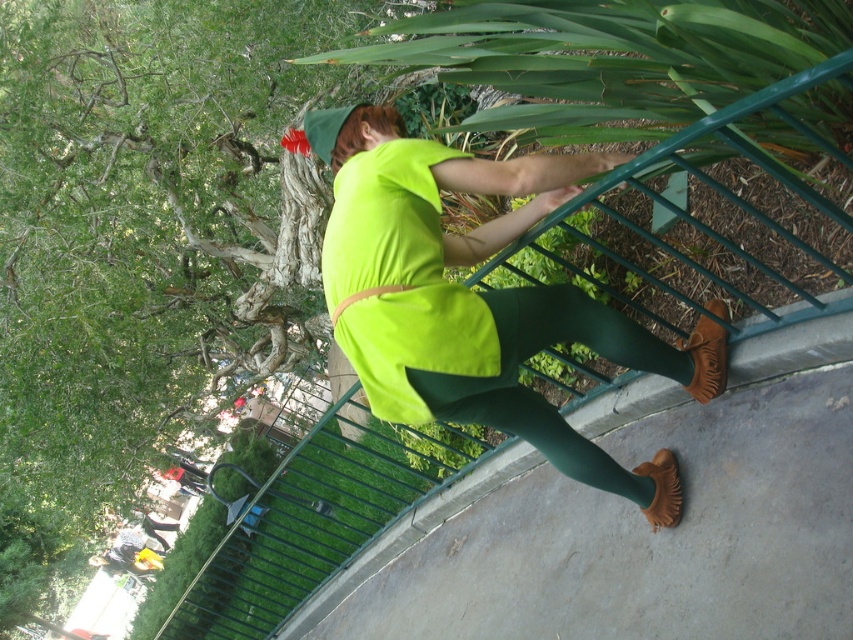
Question: Among these objects, which one is nearest to the camera?

Choices:
 (A) neon green fabric safety vest at center
 (B) green matte leggings at center
 (C) neon green fabric at center

Answer: (A)

Question: Is neon green fabric at center to the left of neon green fabric safety vest at center from the viewer's perspective?

Choices:
 (A) yes
 (B) no

Answer: (B)

Question: Which point appears farthest from the camera in this image?

Choices:
 (A) (503, 321)
 (B) (585, 472)

Answer: (B)

Question: Which object is the farthest from the neon green fabric at center?

Choices:
 (A) green matte leggings at center
 (B) neon green fabric safety vest at center

Answer: (A)

Question: Can you confirm if neon green fabric at center is bigger than green matte leggings at center?

Choices:
 (A) yes
 (B) no

Answer: (A)

Question: Is neon green fabric at center in front of green matte leggings at center?

Choices:
 (A) yes
 (B) no

Answer: (A)